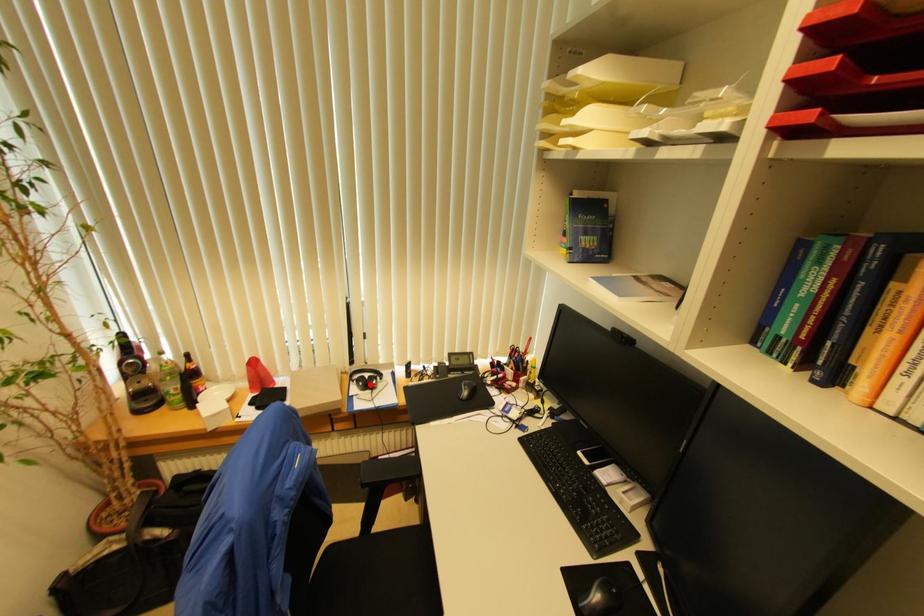
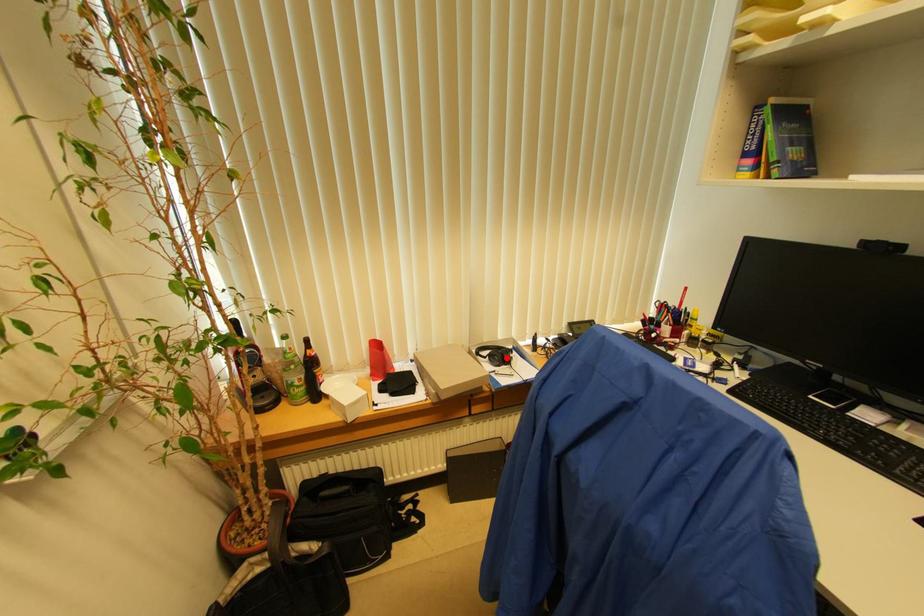
I am providing you with two images of the same scene from different viewpoints. A red point is marked on the first image and another point is marked on the second image. Is the marked point in image1 the same physical position as the marked point in image2?

Yes